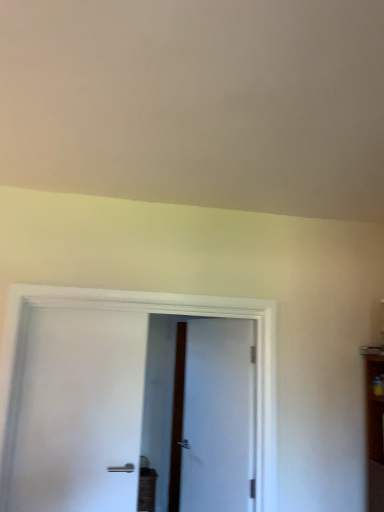
Question: Should I look upward or downward to see white matte door at left, which is the 1th door in left-to-right order?

Choices:
 (A) up
 (B) down

Answer: (B)

Question: Is white matte door at left, marked as the second door in a back-to-front arrangement, turned away from white textured door at center, which is the 1th door in back-to-front order?

Choices:
 (A) no
 (B) yes

Answer: (A)

Question: From a real-world perspective, does white matte door at left, marked as the second door in a back-to-front arrangement, sit lower than white textured door at center, the first door when ordered from right to left?

Choices:
 (A) no
 (B) yes

Answer: (A)

Question: From a real-world perspective, is white matte door at left, marked as the second door in a back-to-front arrangement, over white textured door at center, the first door when ordered from right to left?

Choices:
 (A) no
 (B) yes

Answer: (B)

Question: Is white matte door at left, which is counted as the 2th door, starting from the right, facing towards white textured door at center, which is the 1th door in back-to-front order?

Choices:
 (A) yes
 (B) no

Answer: (B)

Question: Is white matte door at left, which is the 1th door in left-to-right order, shorter than white textured door at center, the second door when ordered from left to right?

Choices:
 (A) yes
 (B) no

Answer: (A)

Question: Considering the relative sizes of white matte door at left, which is counted as the 2th door, starting from the right, and white textured door at center, which is the 2th door in front-to-back order, in the image provided, is white matte door at left, which is counted as the 2th door, starting from the right, thinner than white textured door at center, which is the 2th door in front-to-back order,?

Choices:
 (A) yes
 (B) no

Answer: (A)

Question: Can you confirm if white textured door at center, the second door when ordered from left to right, is positioned to the left of white matte door at left, marked as the second door in a back-to-front arrangement?

Choices:
 (A) no
 (B) yes

Answer: (A)

Question: Is white textured door at center, which is the 1th door in back-to-front order, positioned with its back to white matte door at left, acting as the 1th door starting from the front?

Choices:
 (A) no
 (B) yes

Answer: (B)

Question: Is white textured door at center, the second door when ordered from left to right, wider than white matte door at left, which is the 1th door in left-to-right order?

Choices:
 (A) yes
 (B) no

Answer: (A)

Question: From the image's perspective, is white textured door at center, which is the 1th door in back-to-front order, on top of white matte door at left, which is counted as the 2th door, starting from the right?

Choices:
 (A) yes
 (B) no

Answer: (B)

Question: Is white matte door at left, marked as the second door in a back-to-front arrangement, located within white textured door at center, which is the 1th door in back-to-front order?

Choices:
 (A) no
 (B) yes

Answer: (A)

Question: Does white textured door at center, which is the 2th door in front-to-back order, turn towards white matte door at left, acting as the 1th door starting from the front?

Choices:
 (A) no
 (B) yes

Answer: (B)

Question: Would you say white textured door at center, the second door when ordered from left to right, is to the left or to the right of white matte door at left, which is the 1th door in left-to-right order, in the picture?

Choices:
 (A) left
 (B) right

Answer: (B)